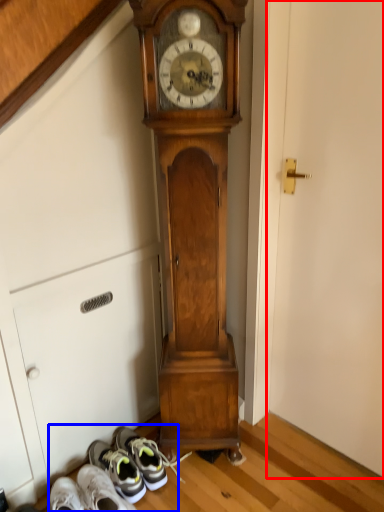
Question: Among these objects, which one is farthest to the camera, door (highlighted by a red box) or shoe (highlighted by a blue box)?

Choices:
 (A) door
 (B) shoe

Answer: (B)